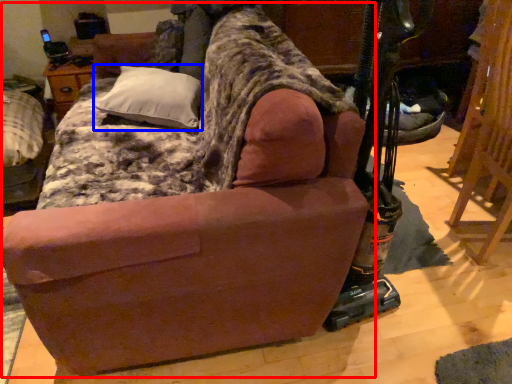
Question: Which of the following is the farthest to the observer, studio couch (highlighted by a red box) or pillow (highlighted by a blue box)?

Choices:
 (A) studio couch
 (B) pillow

Answer: (B)